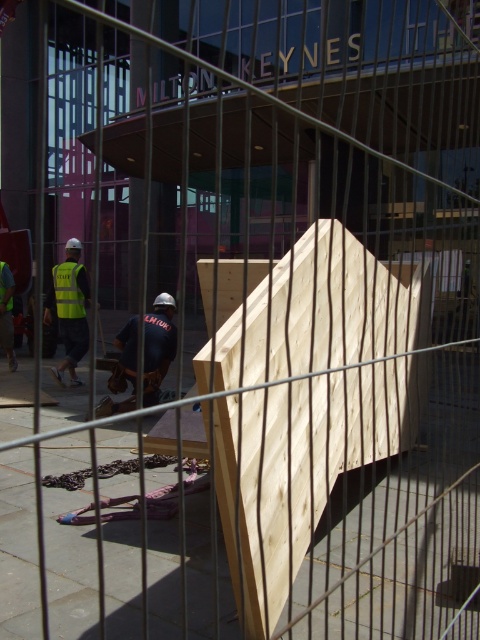
Is natural wood plywood at center positioned behind yellow reflective vest at left?

That is False.

From the picture: Between natural wood plywood at center and yellow reflective vest at left, which one has more height?

yellow reflective vest at left is taller.

Does point (262, 506) come farther from viewer compared to point (72, 288)?

No, (262, 506) is closer to viewer.

Where is `natural wood plywood at center`? This screenshot has height=640, width=480. natural wood plywood at center is located at coordinates (310, 401).

Does yellow reflective vest at left appear on the left side of high visibility fabric safety vest at lower left?

Correct, you'll find yellow reflective vest at left to the left of high visibility fabric safety vest at lower left.

Between yellow reflective vest at left and high visibility fabric safety vest at lower left, which one appears on the left side from the viewer's perspective?

From the viewer's perspective, yellow reflective vest at left appears more on the left side.

Identify the location of yellow reflective vest at left. (70, 308).

Image resolution: width=480 pixels, height=640 pixels. I want to click on yellow reflective vest at left, so click(70, 308).

Can you confirm if yellow reflective vest at left is smaller than reflective yellow vest at left?

Actually, yellow reflective vest at left might be larger than reflective yellow vest at left.

Is the position of yellow reflective vest at left more distant than that of reflective yellow vest at left?

No, yellow reflective vest at left is closer to the viewer.

Describe the element at coordinates (70, 308) in the screenshot. I see `yellow reflective vest at left` at that location.

Where is `yellow reflective vest at left`? yellow reflective vest at left is located at coordinates (70, 308).